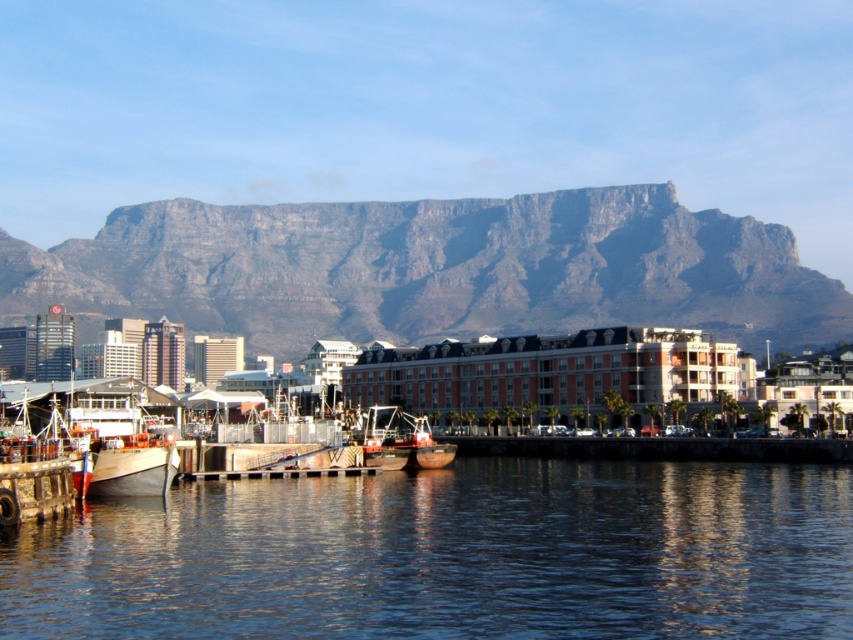
You are a tourist standing at the pier and want to take a photo of the metallic polished boat at center and the gray rocky mountain at upper center. Based on their positions, which object should you place on the left side of your photo to capture both in the frame?

You should place the gray rocky mountain at upper center on the left side of your photo because it is already positioned to the left of the metallic polished boat at center.

You are standing at the point closest to the water in the waterfront scene. Which point, point (398, 609) or point (376, 262), is closer to you?

Point (398, 609) is in front of point (376, 262), so it is closer to you.